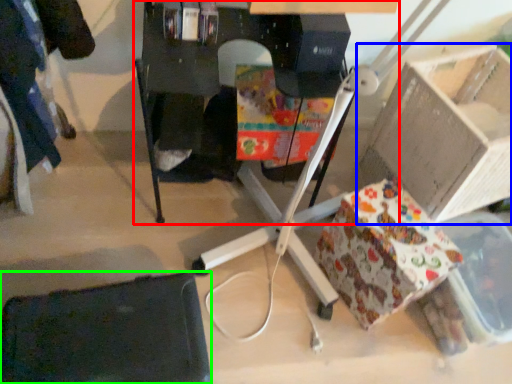
Question: Which object is the farthest from furniture (highlighted by a red box)? Choose among these: cardboard box (highlighted by a blue box) or swivel chair (highlighted by a green box).

Choices:
 (A) cardboard box
 (B) swivel chair

Answer: (B)